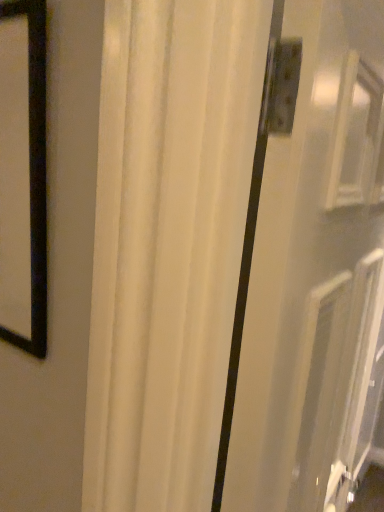
Question: Can you confirm if white glossy screen door at center is thinner than white matte curtain at center?

Choices:
 (A) yes
 (B) no

Answer: (A)

Question: Considering the relative sizes of white glossy screen door at center and white matte curtain at center in the image provided, is white glossy screen door at center wider than white matte curtain at center?

Choices:
 (A) no
 (B) yes

Answer: (A)

Question: Is white glossy screen door at center bigger than white matte curtain at center?

Choices:
 (A) no
 (B) yes

Answer: (A)

Question: From a real-world perspective, is white glossy screen door at center on top of white matte curtain at center?

Choices:
 (A) yes
 (B) no

Answer: (A)

Question: Does white glossy screen door at center turn towards white matte curtain at center?

Choices:
 (A) yes
 (B) no

Answer: (B)

Question: From the image's perspective, is white glossy screen door at center located beneath white matte curtain at center?

Choices:
 (A) no
 (B) yes

Answer: (A)

Question: Does white matte curtain at center have a lesser width compared to white glossy screen door at center?

Choices:
 (A) yes
 (B) no

Answer: (B)

Question: Is white matte curtain at center at the right side of white glossy screen door at center?

Choices:
 (A) yes
 (B) no

Answer: (A)

Question: Does white matte curtain at center contain white glossy screen door at center?

Choices:
 (A) yes
 (B) no

Answer: (B)

Question: Is white matte curtain at center oriented away from white glossy screen door at center?

Choices:
 (A) no
 (B) yes

Answer: (B)

Question: Can we say white matte curtain at center lies outside white glossy screen door at center?

Choices:
 (A) no
 (B) yes

Answer: (B)

Question: From a real-world perspective, does white matte curtain at center sit lower than white glossy screen door at center?

Choices:
 (A) no
 (B) yes

Answer: (B)

Question: In terms of height, does white glossy screen door at center look taller or shorter compared to white matte curtain at center?

Choices:
 (A) short
 (B) tall

Answer: (A)